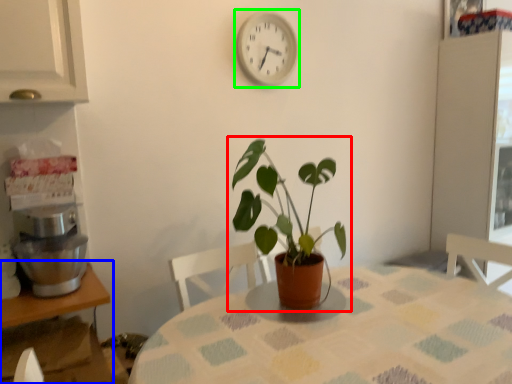
Question: Which is farther away from houseplant (highlighted by a red box)? table (highlighted by a blue box) or clock (highlighted by a green box)?

Choices:
 (A) table
 (B) clock

Answer: (B)